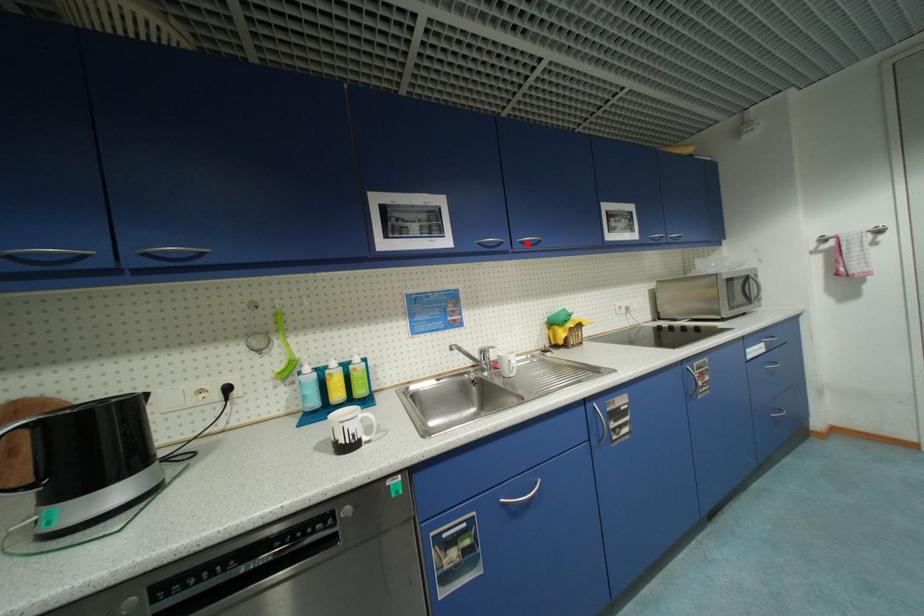
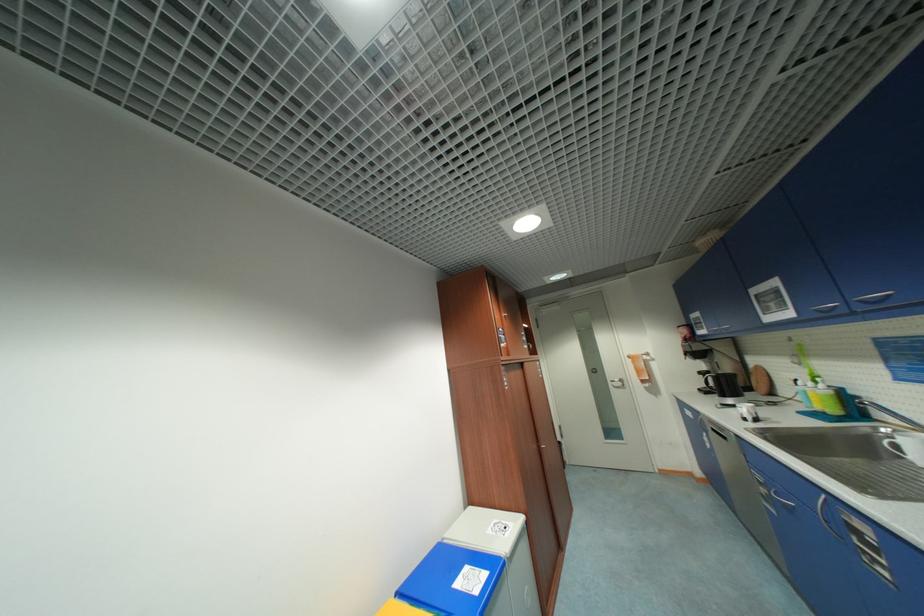
Question: I am providing you with two images of the same scene from different viewpoints. A red point is marked on the first image. Is the red point's position out of view in image 2?

Choices:
 (A) Yes
 (B) No

Answer: (B)